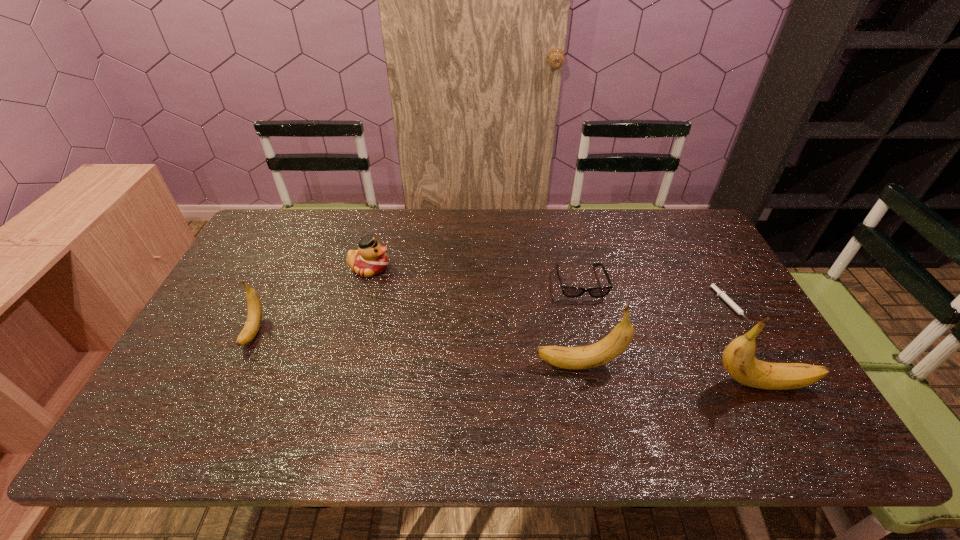
Where is `vacant space located at the start of the peel on the second banana from right to left`? vacant space located at the start of the peel on the second banana from right to left is located at coordinates (483, 365).

Where is `vacant space located 0.200m at the start of the peel on the second banana from right to left`? vacant space located 0.200m at the start of the peel on the second banana from right to left is located at coordinates 455,365.

Identify the location of vacant space situated 0.260m at the start of the peel on the second banana from right to left. (431, 365).

You are a GUI agent. You are given a task and a screenshot of the screen. Output one action in this format:
    pyautogui.click(x=<x>, y=<y>)
    Task: Click on the vacant point located 0.230m on the face of the second object from left to right
    The width and height of the screenshot is (960, 540).
    Given the screenshot: What is the action you would take?
    pyautogui.click(x=464, y=268)

Where is `free space located on the back of the syringe`? The height and width of the screenshot is (540, 960). free space located on the back of the syringe is located at coordinates (711, 273).

Image resolution: width=960 pixels, height=540 pixels. Find the location of `vacant point located on the lenses of the fifth tallest object`. vacant point located on the lenses of the fifth tallest object is located at coordinates (598, 359).

Where is `object situated at the near edge`? The height and width of the screenshot is (540, 960). object situated at the near edge is located at coordinates point(738,358).

You are a GUI agent. You are given a task and a screenshot of the screen. Output one action in this format:
    pyautogui.click(x=<x>, y=<y>)
    Task: Click on the object at the left edge
    
    Given the screenshot: What is the action you would take?
    pyautogui.click(x=254, y=317)

In order to click on banana located at the right edge in this screenshot , I will do `click(738, 358)`.

The height and width of the screenshot is (540, 960). What are the coordinates of `syringe situated at the right edge` in the screenshot? It's located at (732, 304).